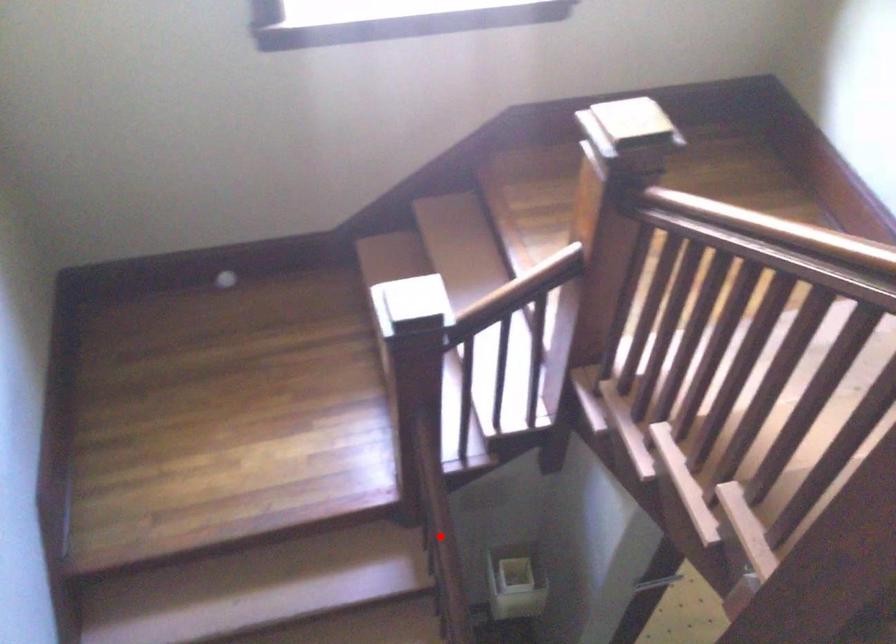
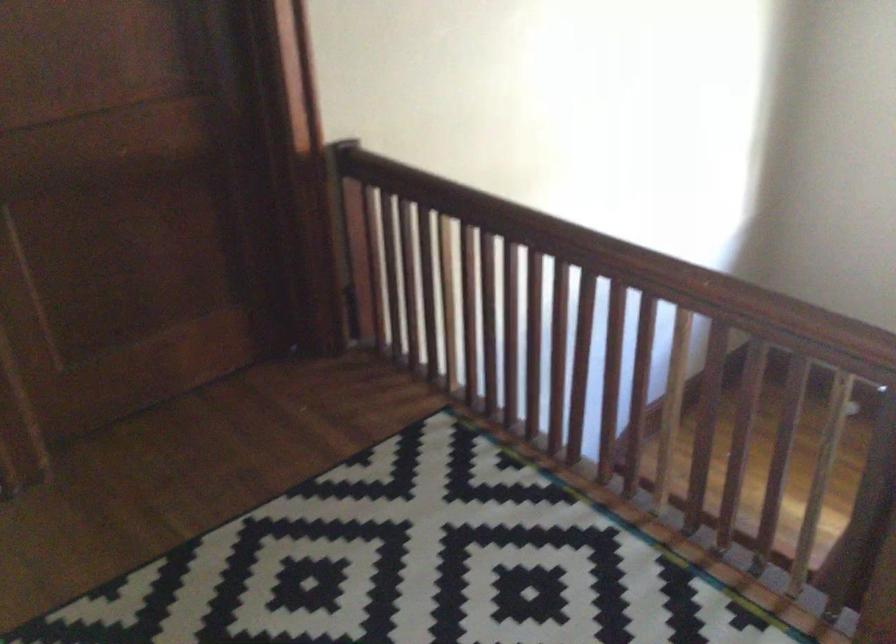
Question: I am providing you with two images of the same scene from different viewpoints. A red point is marked on the first image. At the location where the point appears in image 1, is it still visible in image 2?

Choices:
 (A) Yes
 (B) No

Answer: (B)